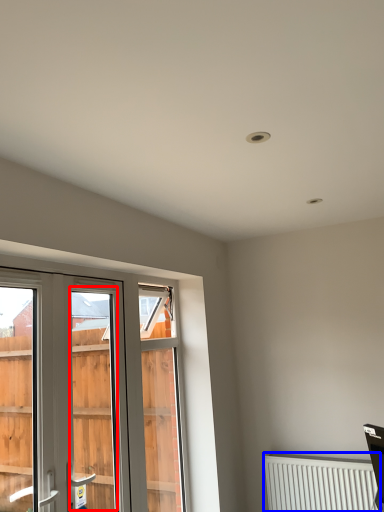
Question: Which object appears farthest to the camera in this image, screen door (highlighted by a red box) or radiator (highlighted by a blue box)?

Choices:
 (A) screen door
 (B) radiator

Answer: (B)